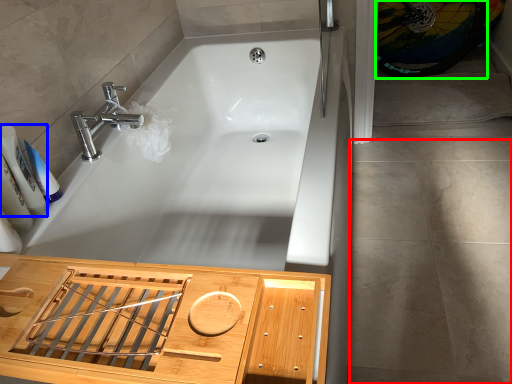
Question: Which object is positioned closest to concrete (highlighted by a red box)? Select from toiletry (highlighted by a blue box) and bicycle wheel (highlighted by a green box).

Choices:
 (A) toiletry
 (B) bicycle wheel

Answer: (B)